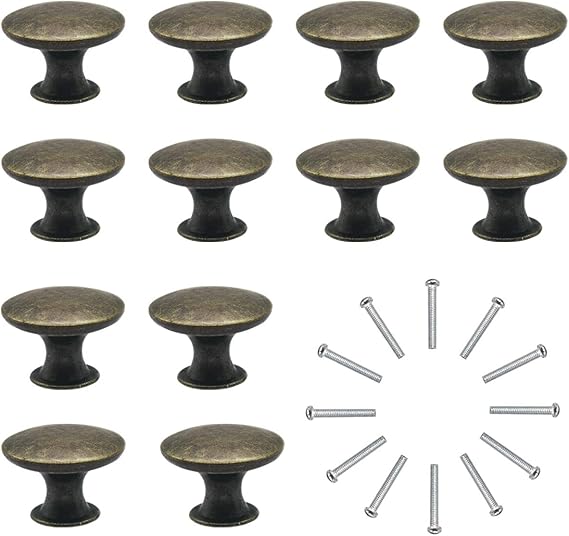
Identify the location of brass knob. This screenshot has width=569, height=536. (508, 33).